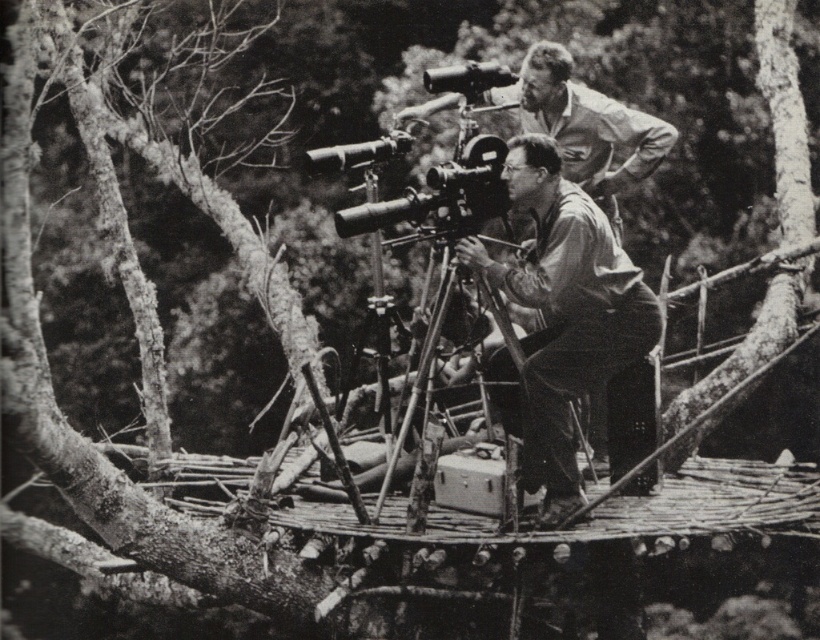
Based on the scene described, can the matte black camera at center be placed on the metallic tripod at center without exceeding its width capacity?

The matte black camera at center might be wider than metallic tripod at center, so there is a possibility that it won not fit properly. Check the width of both items before placing the camera on the tripod.

You are a photographer trying to set up your equipment on the platform. You have a matte black camera at center and a metallic tripod at center. Which object should you adjust first to ensure the camera is properly mounted?

The metallic tripod at center should be adjusted first to ensure the matte black camera at center is properly mounted since the camera is above the tripod and needs a stable base.

You are a photographer trying to set up your equipment on a small platform. You have a matte black camera at center and a metallic tripod at center. Considering the platform has limited space, which object should you adjust first to make more room?

The metallic tripod at center should be adjusted first since the matte black camera at center is taller than it, so lowering the tripod might free up space without affecting the camera setup.